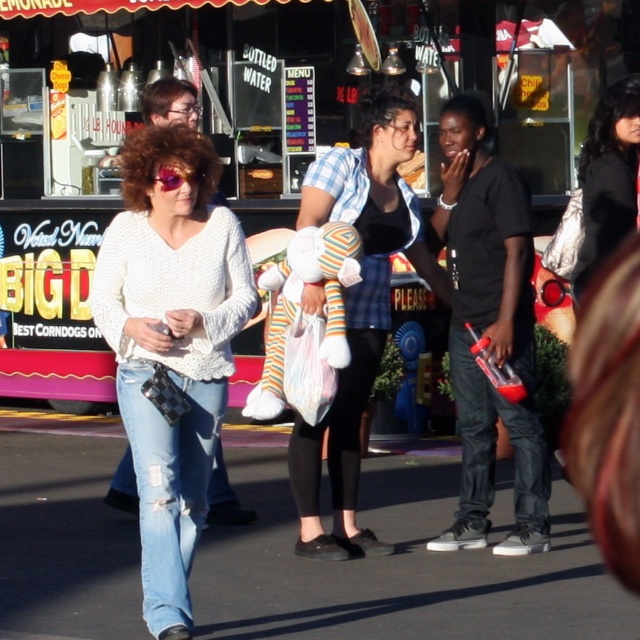
Question: Is denim jeans at lower right above black hair at center?

Choices:
 (A) yes
 (B) no

Answer: (B)

Question: Which point is closer to the camera?

Choices:
 (A) black hair at center
 (B) denim jeans at lower right
 (C) plaid shirt at center

Answer: (C)

Question: Which point is closer to the camera?

Choices:
 (A) plaid shirt at center
 (B) denim jeans at lower right
 (C) white knitted sweater at left

Answer: (C)

Question: Where is black matte shirt at center located in relation to black hair at center in the image?

Choices:
 (A) above
 (B) below

Answer: (B)

Question: Which point is farther to the camera?

Choices:
 (A) (412, 260)
 (B) (148, 216)

Answer: (A)

Question: Is white knitted sweater at left positioned behind black matte shirt at center?

Choices:
 (A) no
 (B) yes

Answer: (A)